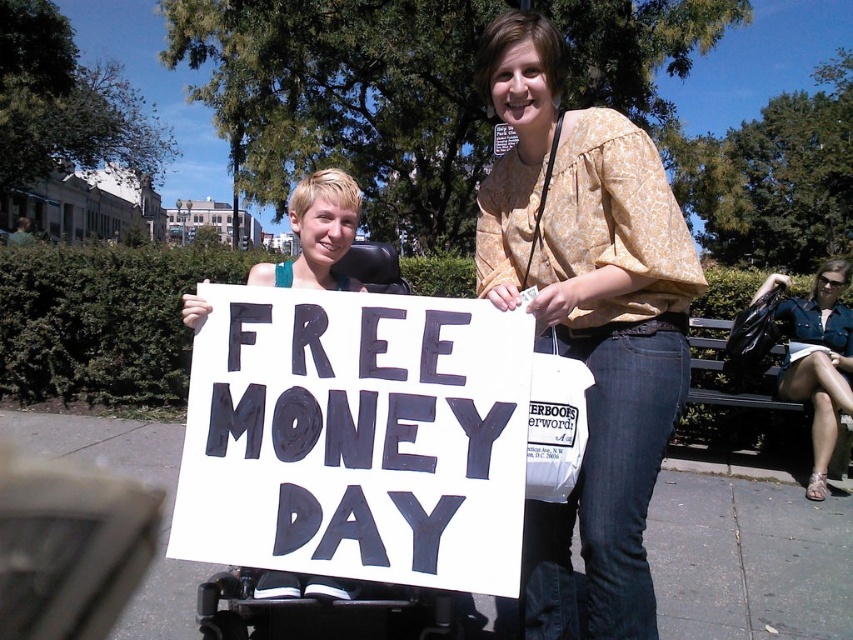
Question: Based on their relative distances, which object is nearer to the denim shorts at lower right?

Choices:
 (A) white paper sign at center
 (B) printed cotton blouse at center

Answer: (B)

Question: Does printed cotton blouse at center appear over denim shorts at lower right?

Choices:
 (A) no
 (B) yes

Answer: (B)

Question: Which is farther from the denim shorts at lower right?

Choices:
 (A) white paper sign at center
 (B) dark brown wooden bench at right
 (C) printed cotton blouse at center

Answer: (A)

Question: Does white paper sign at center come in front of printed cotton blouse at center?

Choices:
 (A) no
 (B) yes

Answer: (B)

Question: Is white paper sign at center positioned behind dark brown wooden bench at right?

Choices:
 (A) no
 (B) yes

Answer: (A)

Question: Estimate the real-world distances between objects in this image. Which object is closer to the denim shorts at lower right?

Choices:
 (A) printed cotton blouse at center
 (B) white paper sign at center
 (C) dark brown wooden bench at right

Answer: (C)